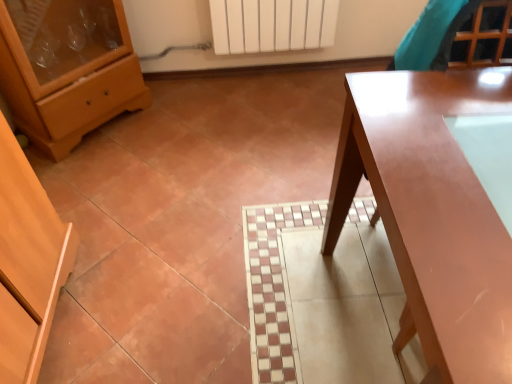
Question: Should I look upward or downward to see glossy wood table at right?

Choices:
 (A) up
 (B) down

Answer: (B)

Question: Is there a large distance between matte wood chest of drawers at left and glossy wood table at right?

Choices:
 (A) no
 (B) yes

Answer: (B)

Question: Does matte wood chest of drawers at left have a greater height compared to glossy wood table at right?

Choices:
 (A) no
 (B) yes

Answer: (A)

Question: Does matte wood chest of drawers at left have a greater width compared to glossy wood table at right?

Choices:
 (A) no
 (B) yes

Answer: (A)

Question: Does matte wood chest of drawers at left turn towards glossy wood table at right?

Choices:
 (A) no
 (B) yes

Answer: (B)

Question: Are matte wood chest of drawers at left and glossy wood table at right beside each other?

Choices:
 (A) yes
 (B) no

Answer: (B)

Question: From a real-world perspective, is matte wood chest of drawers at left on glossy wood table at right?

Choices:
 (A) yes
 (B) no

Answer: (A)

Question: Is glossy wood table at right oriented away from matte wood chest of drawers at left?

Choices:
 (A) yes
 (B) no

Answer: (B)

Question: From the image's perspective, is glossy wood table at right on top of matte wood chest of drawers at left?

Choices:
 (A) yes
 (B) no

Answer: (B)

Question: Is there a large distance between glossy wood table at right and matte wood chest of drawers at left?

Choices:
 (A) no
 (B) yes

Answer: (B)

Question: Does glossy wood table at right touch matte wood chest of drawers at left?

Choices:
 (A) yes
 (B) no

Answer: (B)

Question: From a real-world perspective, is glossy wood table at right positioned over matte wood chest of drawers at left based on gravity?

Choices:
 (A) yes
 (B) no

Answer: (B)

Question: Does glossy wood table at right have a lesser width compared to matte wood chest of drawers at left?

Choices:
 (A) no
 (B) yes

Answer: (A)

Question: From the image's perspective, is glossy wood table at right positioned above or below matte wood chest of drawers at left?

Choices:
 (A) above
 (B) below

Answer: (B)